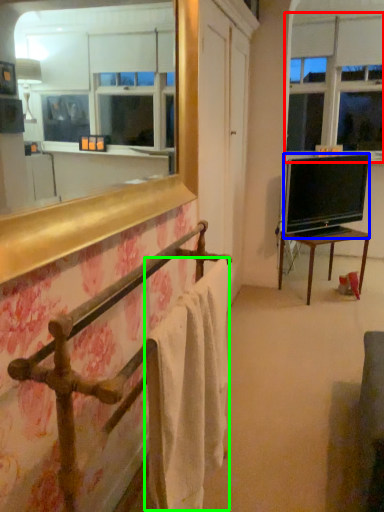
Question: Based on their relative distances, which object is nearer to window screen (highlighted by a red box)? Choose from television (highlighted by a blue box) and bath towel (highlighted by a green box).

Choices:
 (A) television
 (B) bath towel

Answer: (A)